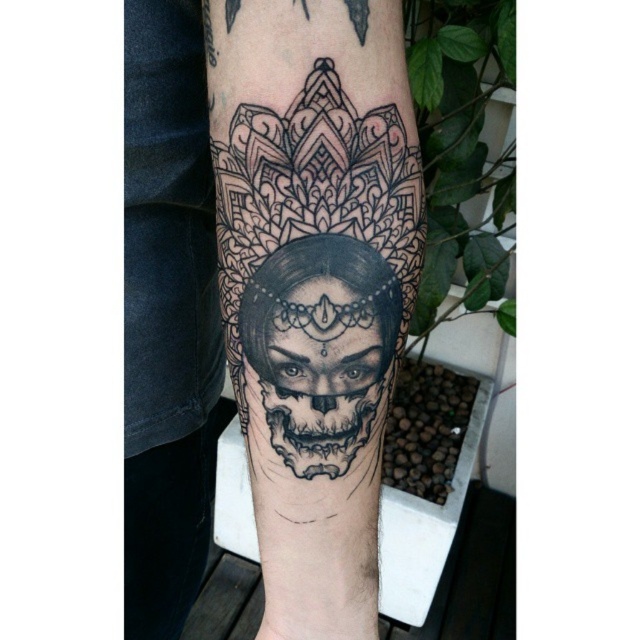
Looking at this image, you are an artist examining a tattoo on someone arm. You see the black tattooed skull at center and the black detailed skull at center. Which one is positioned to the left?

The black tattooed skull at center is positioned to the left of the black detailed skull at center.

You are an artist trying to replicate the tattoo on a canvas. You have two reference points in the tattoo design. The first is the black tattooed skull at center and the second is the black detailed skull at center. Which of these two skulls should you focus on first to ensure proper scaling in your painting?

The black tattooed skull at center is bigger than the black detailed skull at center, so you should focus on scaling the black tattooed skull at center first to ensure the proportions are correct before working on the smaller one.

You are an artist analyzing the placement of the black tattooed skull at center in the forearm tattoo. Based on the coordinates provided, is the skull positioned closer to the wrist or the elbow?

The black tattooed skull at center is located at coordinates point (264, 292). Since the coordinates are closer to 0.5, which is the center of the forearm, the skull is positioned equidistant between the wrist and the elbow.